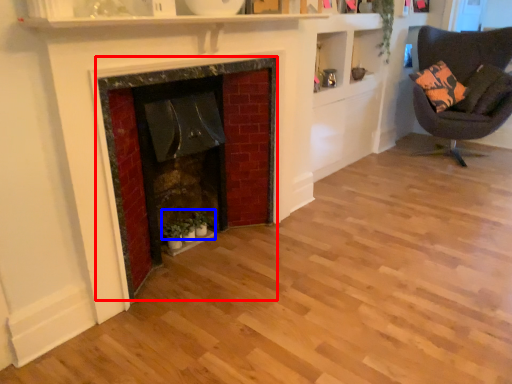
Question: Which point is further to the camera, fireplace (highlighted by a red box) or plant (highlighted by a blue box)?

Choices:
 (A) fireplace
 (B) plant

Answer: (B)